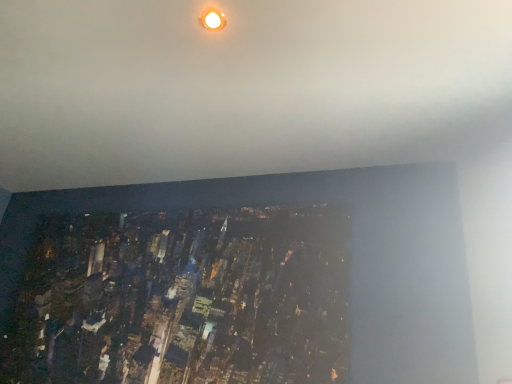
I want to click on matte orange light at upper center, so (x=212, y=19).

The width and height of the screenshot is (512, 384). What do you see at coordinates (212, 19) in the screenshot?
I see `matte orange light at upper center` at bounding box center [212, 19].

What is the approximate width of matte orange light at upper center?

It is 3.97 inches.

At what (x,y) coordinates should I click in order to perform the action: click on matte orange light at upper center. Please return your answer as a coordinate pair (x, y). The width and height of the screenshot is (512, 384). Looking at the image, I should click on (212, 19).